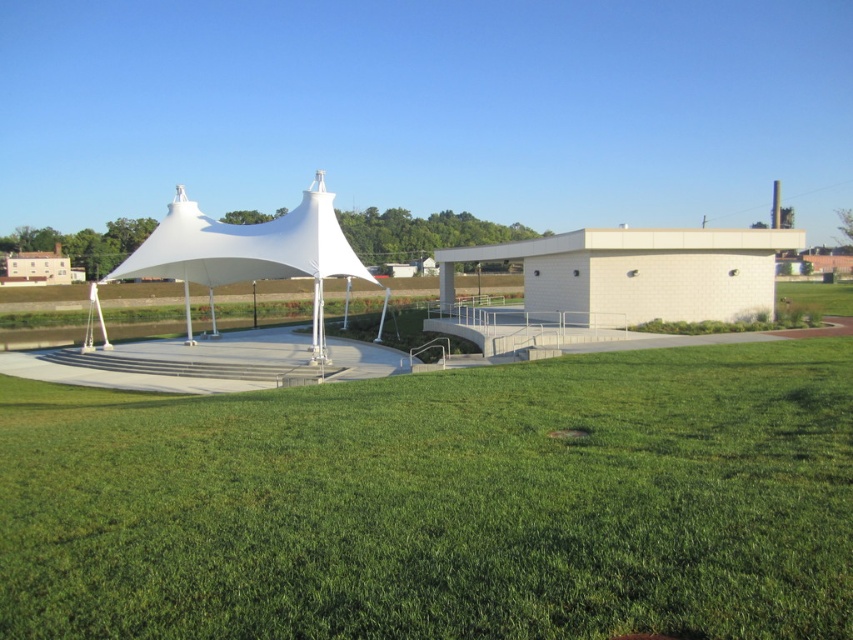
Who is more forward, (819,556) or (288,266)?

Point (819,556)

Is point (532, 538) positioned after point (250, 259)?

That is False.

Which is behind, point (459, 588) or point (170, 256)?

Point (170, 256)

Identify the location of green grass at lower center. This screenshot has width=853, height=640. (440, 502).